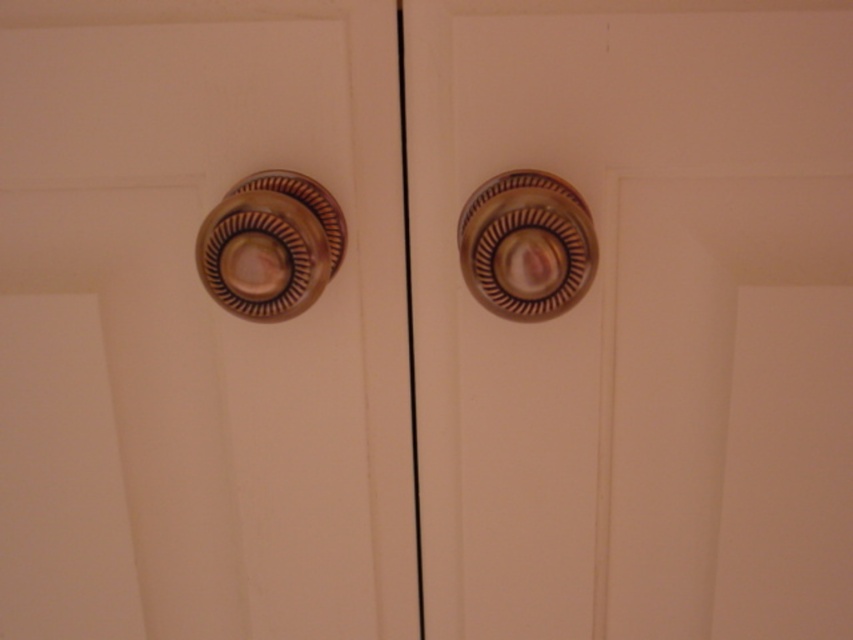
Question: Where is metallic knob at center located in relation to brass textured knob at upper left in the image?

Choices:
 (A) above
 (B) below

Answer: (B)

Question: Observing the image, what is the correct spatial positioning of metallic knob at center in reference to metallic brass knob at center?

Choices:
 (A) right
 (B) left

Answer: (A)

Question: Which of the following is the farthest from the observer?

Choices:
 (A) metallic brass knob at center-right
 (B) brass textured knob at upper left
 (C) metallic brass knob at center
 (D) metallic knob at center

Answer: (C)

Question: Based on their relative distances, which object is farther from the metallic brass knob at center-right?

Choices:
 (A) brass textured knob at upper left
 (B) metallic brass knob at center

Answer: (B)

Question: Among these points, which one is farthest from the camera?

Choices:
 (A) (138, 460)
 (B) (729, 522)
 (C) (515, 196)
 (D) (212, 237)

Answer: (A)

Question: Can you confirm if metallic knob at center is bigger than metallic brass knob at center?

Choices:
 (A) yes
 (B) no

Answer: (B)